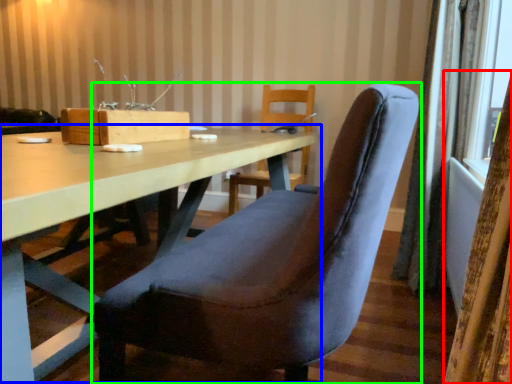
Question: Which object is the closest to the curtain (highlighted by a red box)? Choose among these: table (highlighted by a blue box) or chair (highlighted by a green box).

Choices:
 (A) table
 (B) chair

Answer: (B)